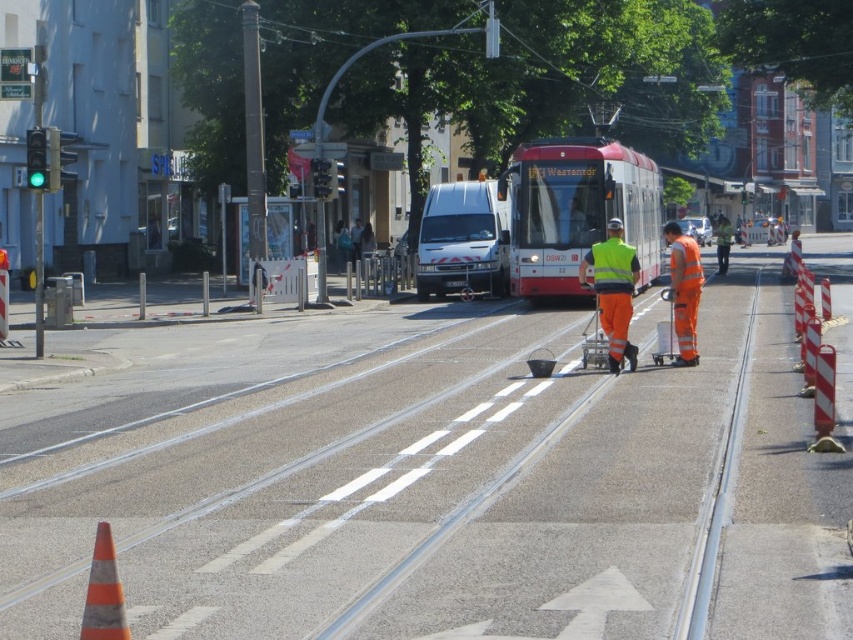
You are a pedestrian crossing the tram tracks in the foreground. You see two workers wearing high visibility orange reflective pants at center and orange reflective workwear at center. Which worker is closer to the tram tracks on the right side?

The orange reflective workwear at center is closer to the tram tracks on the right side because the high visibility orange reflective pants at center is to the left of orange reflective workwear at center.

You are a pedestrian trying to cross the tram tracks safely. There are two workers in the area. One is wearing high visibility orange reflective pants at center and the other is wearing orange reflective workwear at center. Which worker is closer to you?

The high visibility orange reflective pants at center is closer to you because it is further to the viewer than orange reflective workwear at center.